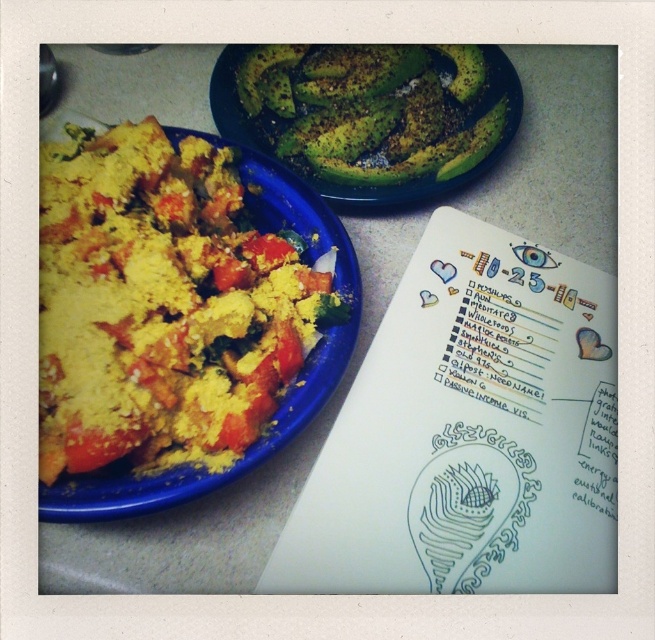
Does yellow crumbly at left appear over green matte avocado at upper center?

No.

Is yellow crumbly at left positioned behind green matte avocado at upper center?

No, yellow crumbly at left is in front of green matte avocado at upper center.

Who is more distant from viewer, [168,147] or [356,51]?

Point [356,51]

This screenshot has width=655, height=640. Identify the location of yellow crumbly at left. (159, 304).